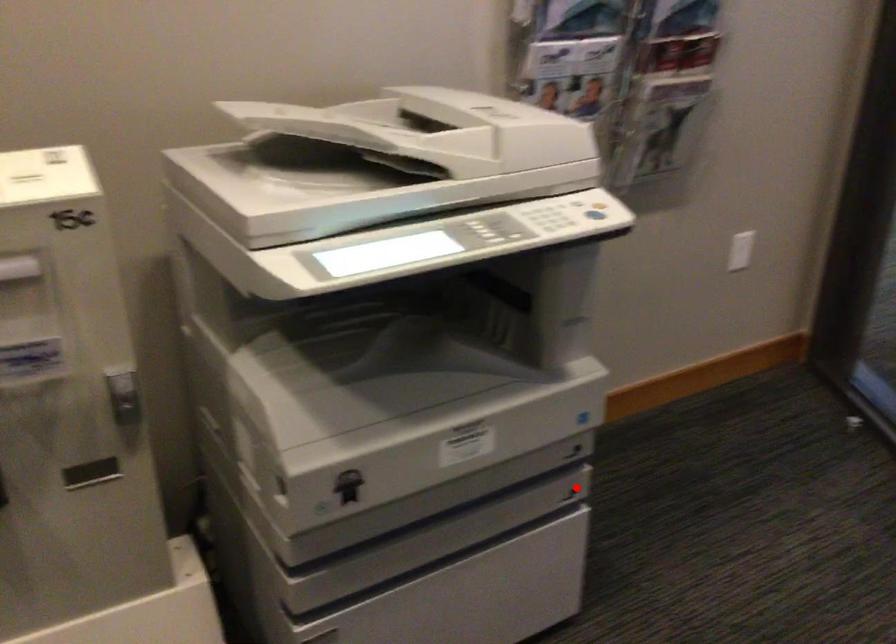
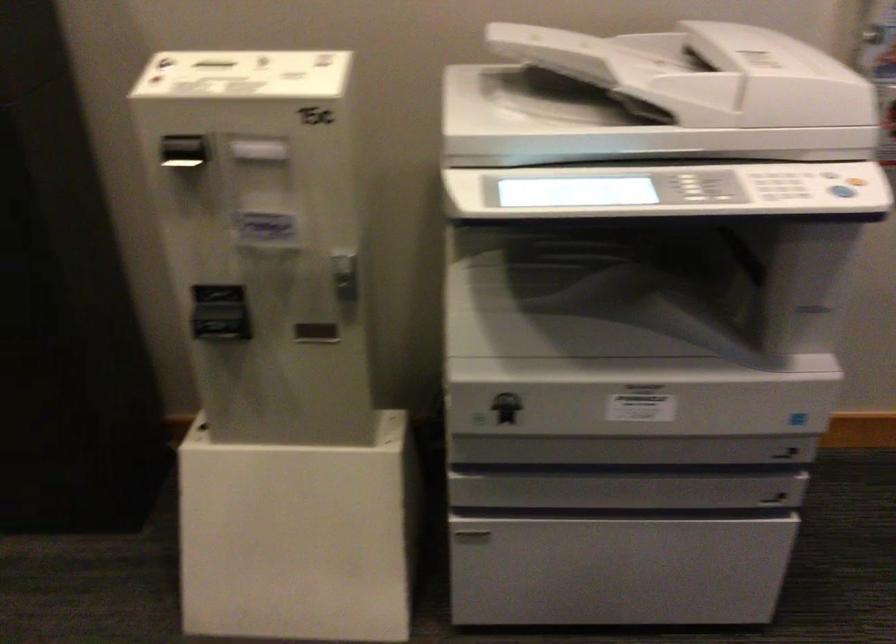
Question: I am providing you with two images of the same scene from different viewpoints. A red point is marked on the first image. Is the red point's position out of view in image 2?

Choices:
 (A) Yes
 (B) No

Answer: (B)